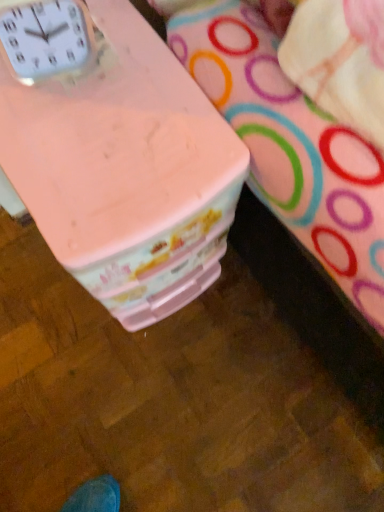
This screenshot has width=384, height=512. I want to click on white plastic clock at upper left, so click(x=47, y=39).

Consider the image. What is the approximate height of white plastic clock at upper left?

It is 4.23 inches.

The height and width of the screenshot is (512, 384). Describe the element at coordinates (47, 39) in the screenshot. I see `white plastic clock at upper left` at that location.

Measure the distance between point (47, 46) and camera.

The distance of point (47, 46) from camera is 20.55 inches.

Find the location of a particular element. pink plastic container at center is located at coordinates (116, 154).

Measure the distance between point (203, 253) and camera.

76.10 centimeters.

The image size is (384, 512). Describe the element at coordinates (116, 154) in the screenshot. I see `pink plastic container at center` at that location.

This screenshot has height=512, width=384. In order to click on white plastic clock at upper left in this screenshot , I will do `click(47, 39)`.

Can you confirm if pink plastic container at center is positioned to the right of white plastic clock at upper left?

Yes.

Does pink plastic container at center come in front of white plastic clock at upper left?

No, it is behind white plastic clock at upper left.

Is point (157, 225) less distant than point (25, 9)?

No, it is not.

From the image's perspective, which one is positioned higher, pink plastic container at center or white plastic clock at upper left?

white plastic clock at upper left appears higher in the image.

From a real-world perspective, is pink plastic container at center physically above white plastic clock at upper left?

No, from a real-world perspective, pink plastic container at center is not on top of white plastic clock at upper left.

Can you confirm if pink plastic container at center is wider than white plastic clock at upper left?

Indeed, pink plastic container at center has a greater width compared to white plastic clock at upper left.

Is pink plastic container at center taller or shorter than white plastic clock at upper left?

pink plastic container at center is taller than white plastic clock at upper left.

Considering the relative sizes of pink plastic container at center and white plastic clock at upper left in the image provided, is pink plastic container at center bigger than white plastic clock at upper left?

Yes, pink plastic container at center is bigger than white plastic clock at upper left.

Is pink plastic container at center inside or outside of white plastic clock at upper left?

pink plastic container at center is not enclosed by white plastic clock at upper left.

In the scene shown: Is pink plastic container at center beside white plastic clock at upper left?

They are not placed beside each other.

In the scene shown: Is pink plastic container at center facing away from white plastic clock at upper left?

pink plastic container at center does not have its back to white plastic clock at upper left.

Based on the photo, how far apart are pink plastic container at center and white plastic clock at upper left?

The distance of pink plastic container at center from white plastic clock at upper left is 6.48 inches.

Where is `table behind the white plastic clock at upper left`? This screenshot has width=384, height=512. table behind the white plastic clock at upper left is located at coordinates (116, 154).

Which object is positioned more to the left, white plastic clock at upper left or pink plastic container at center?

From the viewer's perspective, white plastic clock at upper left appears more on the left side.

Between white plastic clock at upper left and pink plastic container at center, which one is positioned in front?

white plastic clock at upper left is closer to the camera.

Looking at this image, which point is more distant from viewer, [15,16] or [106,285]?

Point [106,285]

From the image's perspective, is white plastic clock at upper left under pink plastic container at center?

No, from the image's perspective, white plastic clock at upper left is not below pink plastic container at center.

From a real-world perspective, relative to pink plastic container at center, is white plastic clock at upper left vertically above or below?

white plastic clock at upper left is situated higher than pink plastic container at center in the real world.

Between white plastic clock at upper left and pink plastic container at center, which one has smaller width?

white plastic clock at upper left.

In terms of height, does white plastic clock at upper left look taller or shorter compared to pink plastic container at center?

Considering their sizes, white plastic clock at upper left has less height than pink plastic container at center.

Can you confirm if white plastic clock at upper left is smaller than pink plastic container at center?

Yes.

Can we say white plastic clock at upper left lies outside pink plastic container at center?

Yes, white plastic clock at upper left is not within pink plastic container at center.

Would you say white plastic clock at upper left is a long distance from pink plastic container at center?

No.

Based on the photo, is white plastic clock at upper left oriented towards pink plastic container at center?

No, white plastic clock at upper left is not oriented towards pink plastic container at center.

Can you tell me how much white plastic clock at upper left and pink plastic container at center differ in facing direction?

The angular difference between white plastic clock at upper left and pink plastic container at center is 13.5 degrees.

The image size is (384, 512). I want to click on clock located on the left of pink plastic container at center, so click(x=47, y=39).

I want to click on table below the white plastic clock at upper left (from a real-world perspective), so pos(116,154).

Where is `table located on the right of white plastic clock at upper left`? The image size is (384, 512). table located on the right of white plastic clock at upper left is located at coordinates (116, 154).